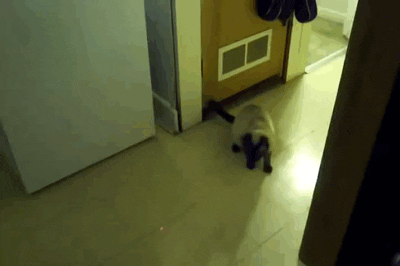
Locate an element on the screen. This screenshot has height=266, width=400. open doorway into another room is located at coordinates (329, 19).